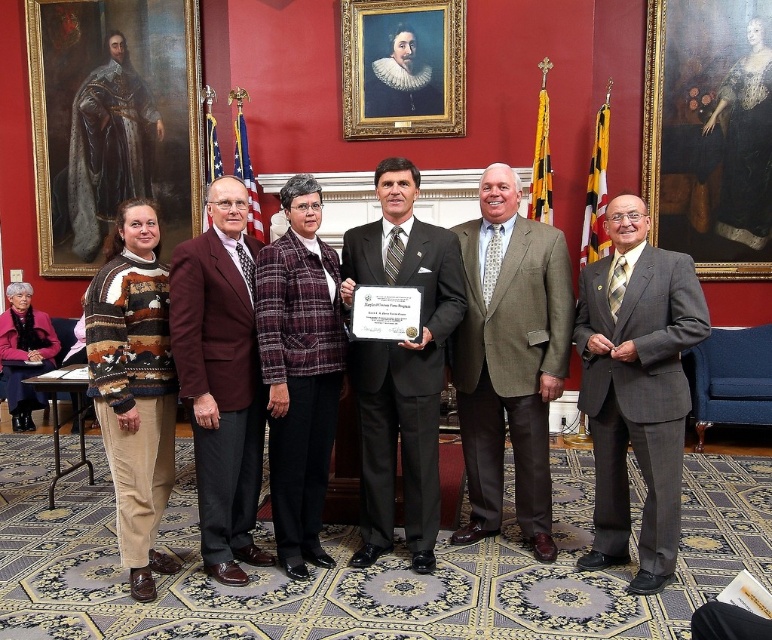
You are standing in the room where the group photo was taken. You notice two points marked at coordinates point (175,3) and point (232,316). Which point is closer to you?

Point (175,3) is closer to you because it is further to the viewer than point (232,316).

You are a photographer adjusting the camera settings to ensure all elements in the scene are in focus. Considering the maroon wool suit at left and the goldwooden frame at upper center, which object is positioned closer to the camera?

The maroon wool suit at left is much taller as the goldwooden frame at upper center, so the maroon wool suit at left is closer to the camera.